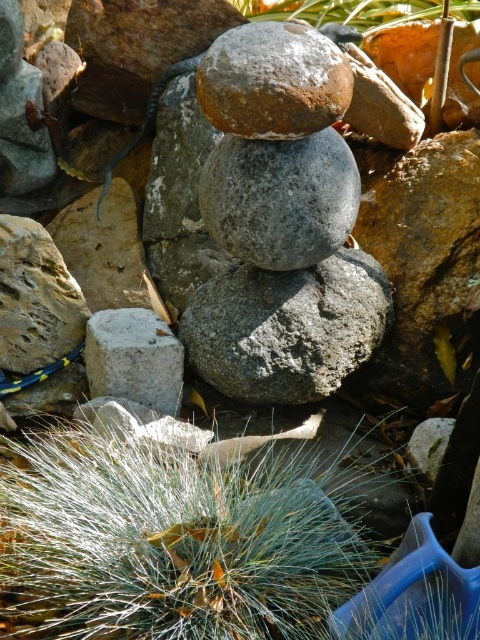
You are standing in front of the rock arrangement and want to place a small flag at the point that is closer to you. Which point should you choose between point (122, 387) and point (304, 17)?

Point (122, 387) is closer to the camera than point (304, 17), so you should place the flag at point (122, 387).

You are a gardener who wants to place a new decorative item in the garden. You have a small statue that is 10 cm wide. The statue needs to be placed on a surface that is at least as wide as the statue. Based on the image, can the gray matte rock at center or the green grass at lower center support the statue?

The green grass at lower center is bigger than the gray matte rock at center. Since the statue requires a surface at least 10 cm wide, the green grass at lower center can support it, but the gray matte rock at center may not be wide enough.

You are standing in the garden and see the gray matte rock at center and the gray rough concrete block at lower left. Which object is positioned more to the left?

The gray rough concrete block at lower left is positioned more to the left than the gray matte rock at center.